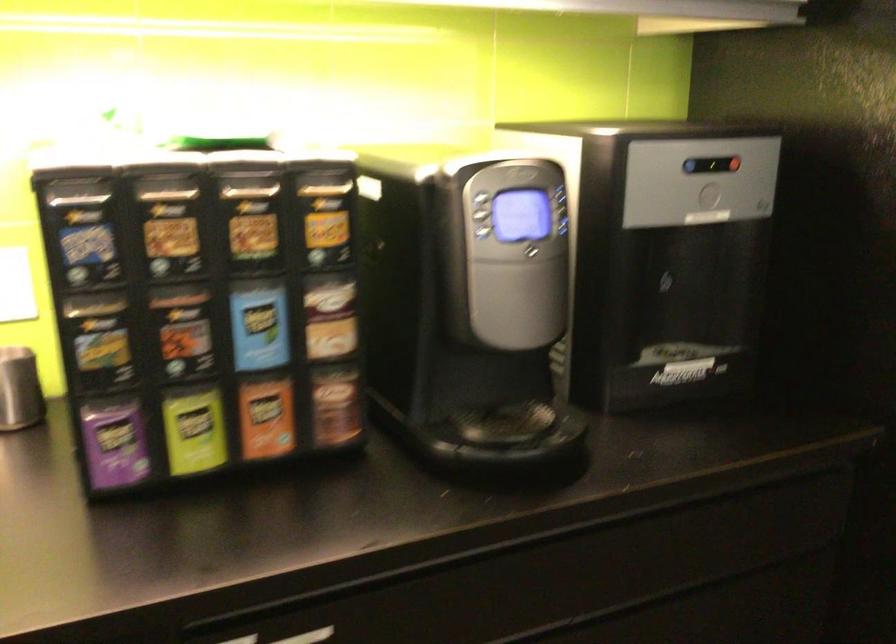
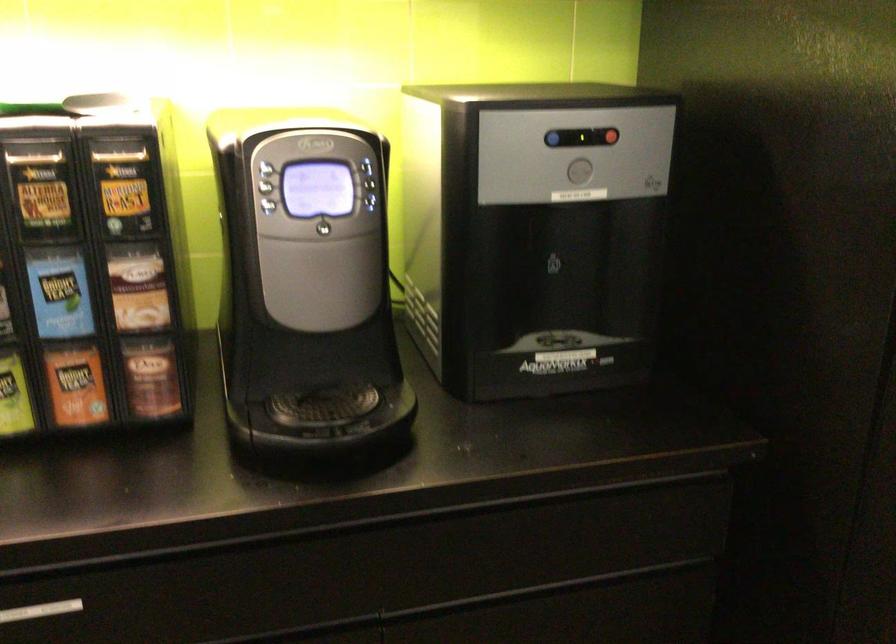
In the second image, find the point that corresponds to the point at 483,232 in the first image.

(268, 205)